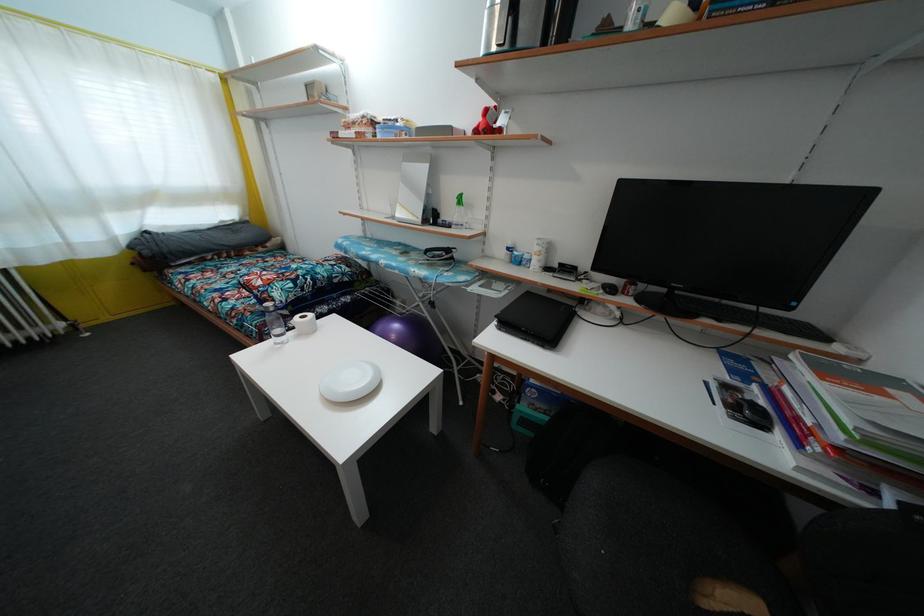
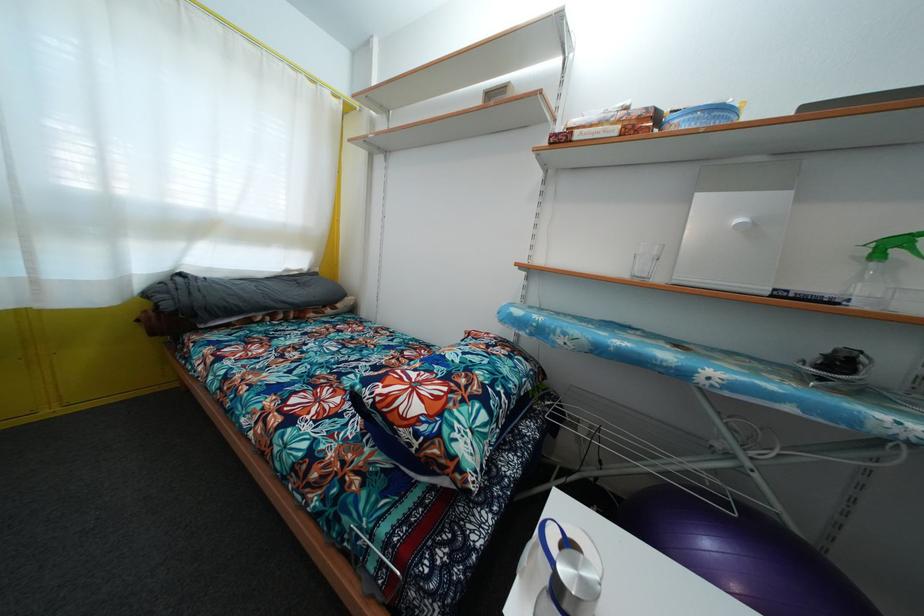
In the scene shown: In a continuous first-person perspective shot, in which direction is the camera moving?

The movement direction of the cameraman is left, forward.